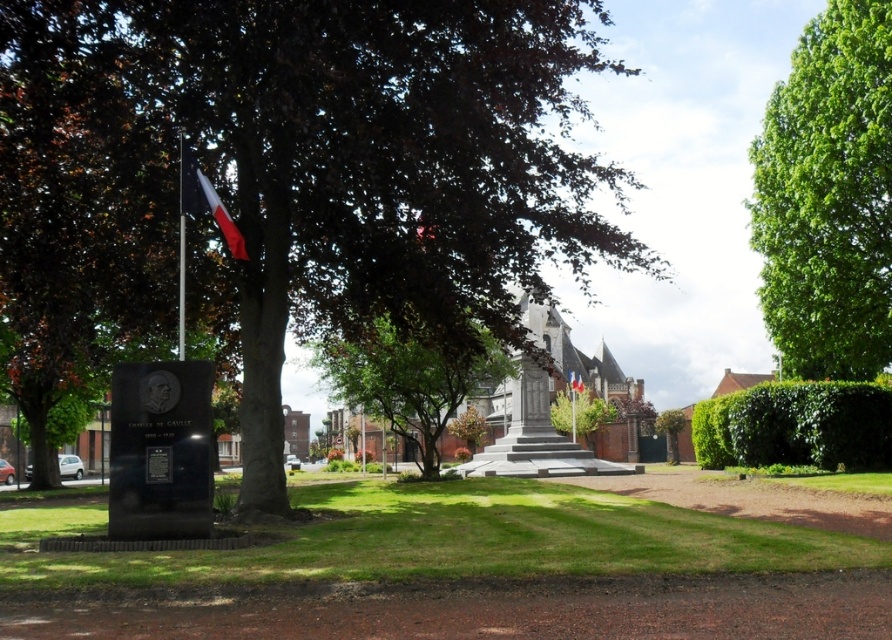
Can you confirm if metallic flag pole at upper center is positioned below polished red flag at left?

Yes.

Can you confirm if metallic flag pole at upper center is thinner than polished red flag at left?

No, metallic flag pole at upper center is not thinner than polished red flag at left.

Locate an element on the screen. metallic flag pole at upper center is located at coordinates (180, 244).

Who is more distant from viewer, (x=778, y=84) or (x=573, y=388)?

Point (x=573, y=388)

Who is positioned more to the right, green leafy tree at upper right or red fabric flag at center?

green leafy tree at upper right is more to the right.

Where is `green leafy tree at upper right`? The image size is (892, 640). green leafy tree at upper right is located at coordinates (828, 196).

Is the position of green leafy tree at upper right less distant than that of green leafy tree at center?

That is True.

Is green leafy tree at upper right shorter than green leafy tree at center?

No, green leafy tree at upper right is not shorter than green leafy tree at center.

This screenshot has width=892, height=640. What do you see at coordinates (828, 196) in the screenshot?
I see `green leafy tree at upper right` at bounding box center [828, 196].

What are the coordinates of `green leafy tree at upper right` in the screenshot? It's located at (828, 196).